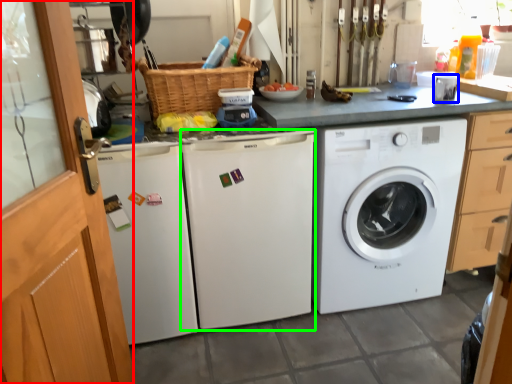
Question: Which is nearer to the screen door (highlighted by a red box)? appliance (highlighted by a blue box) or washing machine (highlighted by a green box).

Choices:
 (A) appliance
 (B) washing machine

Answer: (B)